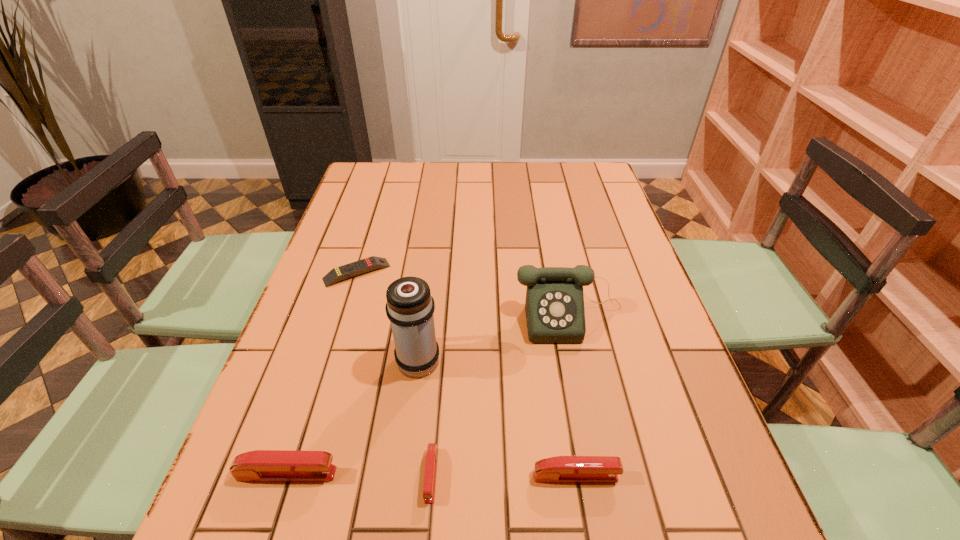
Where is `vacant space situated on the front-facing side of the rightmost stapler`? vacant space situated on the front-facing side of the rightmost stapler is located at coordinates pos(701,476).

Locate an element on the screen. This screenshot has height=540, width=960. vacant area situated 0.110m on the side with the handle of the thermos bottle is located at coordinates [425, 305].

Locate an element on the screen. This screenshot has width=960, height=540. vacant space positioned 0.290m on the side with the handle of the thermos bottle is located at coordinates click(431, 259).

Identify the location of vacant space located 0.200m on the side with the handle of the thermos bottle. The image size is (960, 540). (428, 281).

At what (x,y) coordinates should I click in order to perform the action: click on free point located on the dial of the second tallest object. Please return your answer as a coordinate pair (x, y). Looking at the image, I should click on (591, 419).

This screenshot has width=960, height=540. Identify the location of blank space located on the front of the remote control. (315, 406).

The width and height of the screenshot is (960, 540). Find the location of `stapler present at the left edge`. stapler present at the left edge is located at coordinates (261, 465).

Locate an element on the screen. remote control located in the left edge section of the desktop is located at coordinates (371, 263).

Locate an element on the screen. Image resolution: width=960 pixels, height=540 pixels. object at the right edge is located at coordinates (554, 306).

Find the location of `object that is at the near left corner`. object that is at the near left corner is located at coordinates (261, 465).